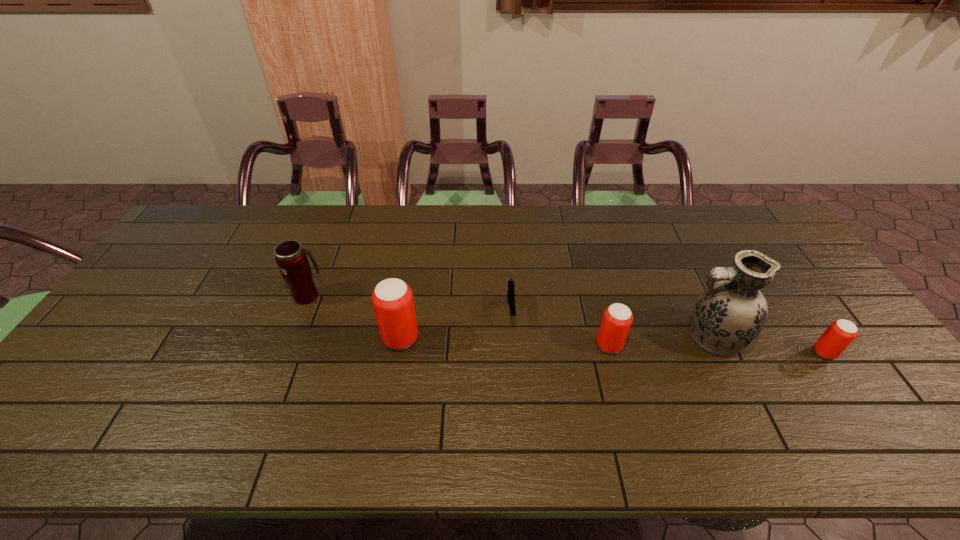
In order to click on vacant area situated 0.080m with the handle on the side of the vase in this screenshot , I will do `click(650, 338)`.

This screenshot has height=540, width=960. Identify the location of object at the right edge. (836, 338).

This screenshot has height=540, width=960. In order to click on vacant space at the far edge of the desktop in this screenshot , I will do `click(372, 219)`.

This screenshot has width=960, height=540. Find the location of `vacant space at the near edge of the desktop`. vacant space at the near edge of the desktop is located at coordinates (787, 414).

In the image, there is a desktop. In order to click on vacant space at the left edge in this screenshot , I will do `click(175, 293)`.

What are the coordinates of `free space at the right edge of the desktop` in the screenshot? It's located at (775, 298).

Find the location of a particular element. The height and width of the screenshot is (540, 960). vacant space at the far right corner of the desktop is located at coordinates (762, 220).

In order to click on vacant space in between the leftmost beer can and the vase in this screenshot , I will do `click(557, 338)`.

Where is `free spot between the vase and the tallest beer can`? The height and width of the screenshot is (540, 960). free spot between the vase and the tallest beer can is located at coordinates (557, 338).

Locate an element on the screen. vacant space that's between the fourth object from left to right and the tallest object is located at coordinates (660, 341).